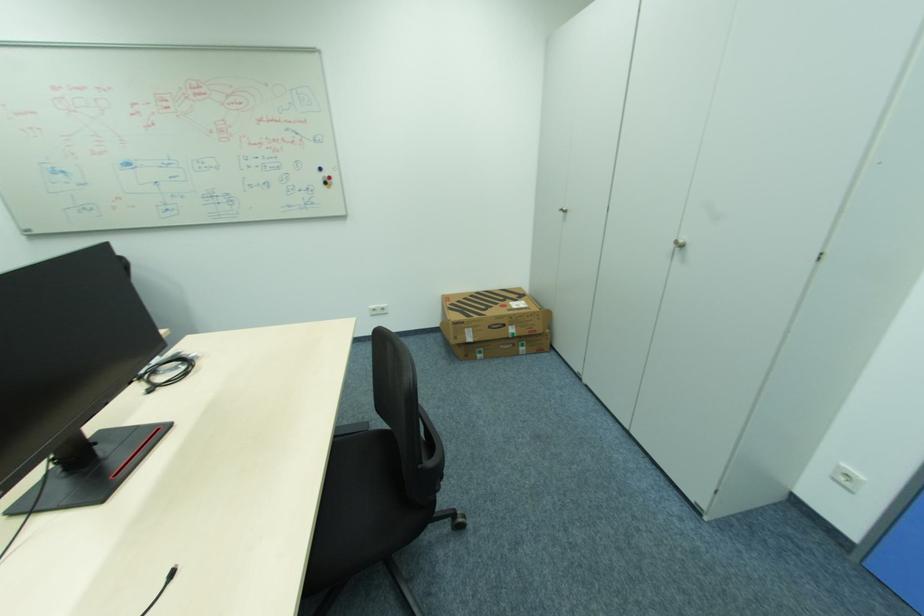
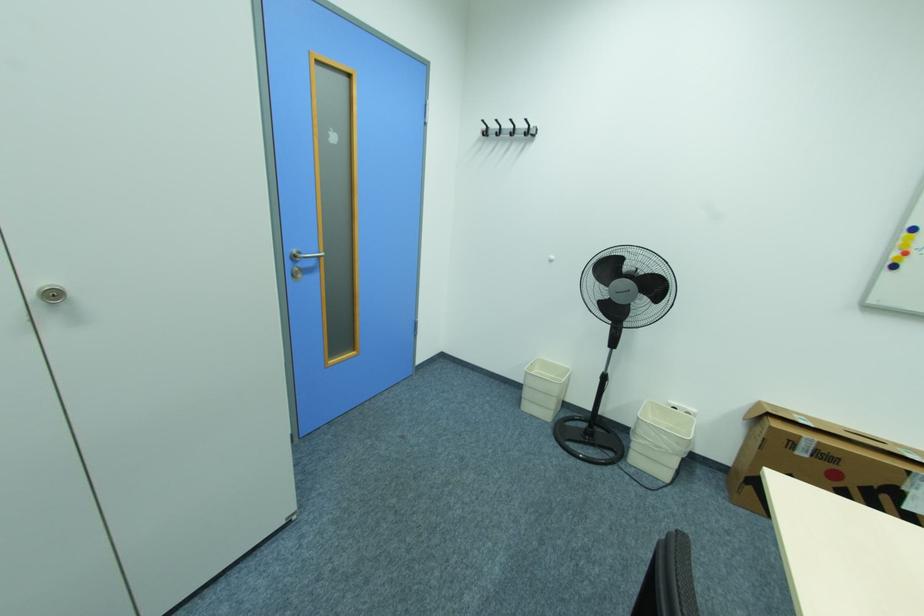
The point at [687,246] is marked in the first image. Where is the corresponding point in the second image?

(64, 294)